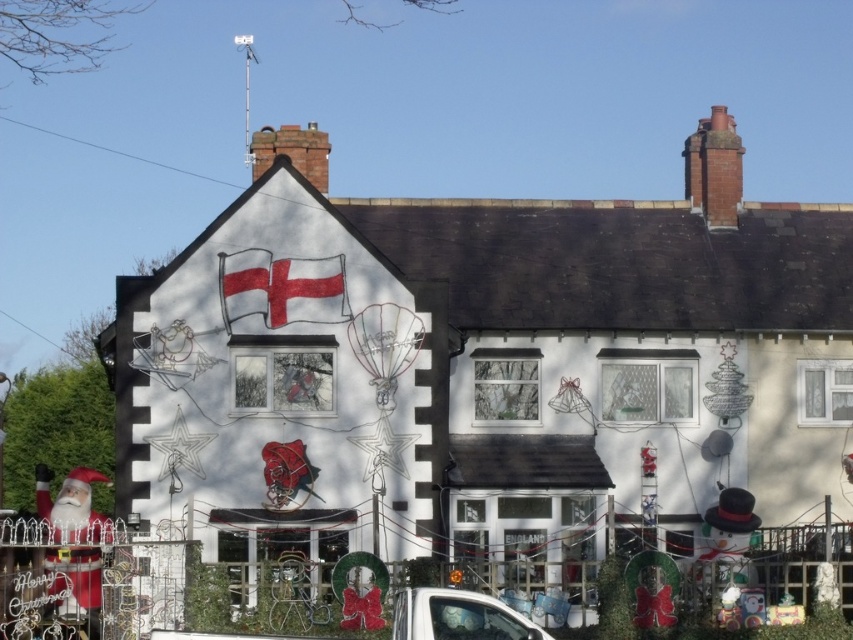
Is red matte flag at upper left shorter than red fabric santa claus at lower left?

Correct, red matte flag at upper left is not as tall as red fabric santa claus at lower left.

How distant is red matte flag at upper left from red fabric santa claus at lower left?

red matte flag at upper left and red fabric santa claus at lower left are 8.85 meters apart from each other.

Between point (341, 259) and point (100, 518), which one is positioned behind?

The point (100, 518) is behind.

Identify the location of red matte flag at upper left. (282, 289).

Can you confirm if red fabric santa claus at lower left is thinner than white glossy car at lower center?

Incorrect, red fabric santa claus at lower left's width is not less than white glossy car at lower center's.

Who is higher up, red fabric santa claus at lower left or white glossy car at lower center?

white glossy car at lower center is above.

Measure the distance between red fabric santa claus at lower left and camera.

A distance of 195.83 feet exists between red fabric santa claus at lower left and camera.

The height and width of the screenshot is (640, 853). In order to click on red fabric santa claus at lower left in this screenshot , I will do `click(71, 506)`.

Between red matte flag at upper left and white glossy car at lower center, which one is positioned lower?

Positioned lower is white glossy car at lower center.

Who is more distant from viewer, (306, 268) or (426, 627)?

Positioned behind is point (306, 268).

Find the location of a particular element. The height and width of the screenshot is (640, 853). red matte flag at upper left is located at coordinates (282, 289).

Locate an element on the screen. The width and height of the screenshot is (853, 640). red matte flag at upper left is located at coordinates (282, 289).